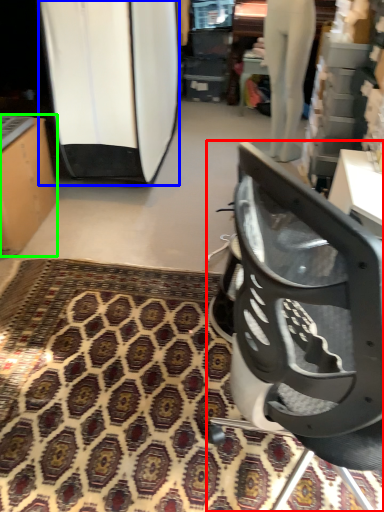
Question: Which object is positioned closest to chair (highlighted by a red box)? Select from surfboard (highlighted by a blue box) and furniture (highlighted by a green box).

Choices:
 (A) surfboard
 (B) furniture

Answer: (B)